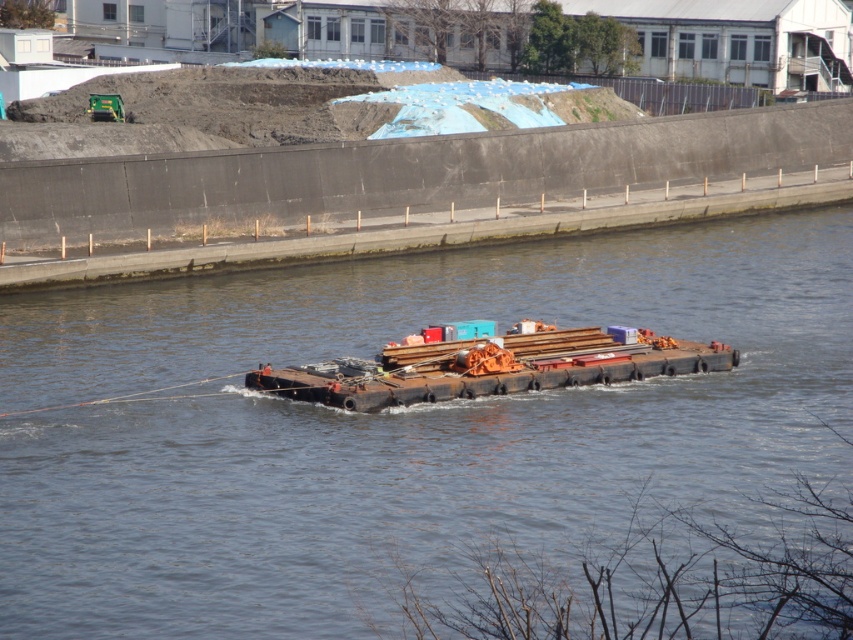
Question: From the image, what is the correct spatial relationship of brown rubber barge at center in relation to rusty metal barge at center?

Choices:
 (A) below
 (B) above

Answer: (B)

Question: Which point appears farthest from the camera in this image?

Choices:
 (A) (457, 316)
 (B) (627, 365)

Answer: (A)

Question: Which point is farther from the camera taking this photo?

Choices:
 (A) (263, 406)
 (B) (567, 353)

Answer: (B)

Question: Is brown rubber barge at center thinner than rusty metal barge at center?

Choices:
 (A) yes
 (B) no

Answer: (B)

Question: Does brown rubber barge at center come behind rusty metal barge at center?

Choices:
 (A) yes
 (B) no

Answer: (B)

Question: Which point is farther to the camera?

Choices:
 (A) (457, 522)
 (B) (469, 387)

Answer: (B)